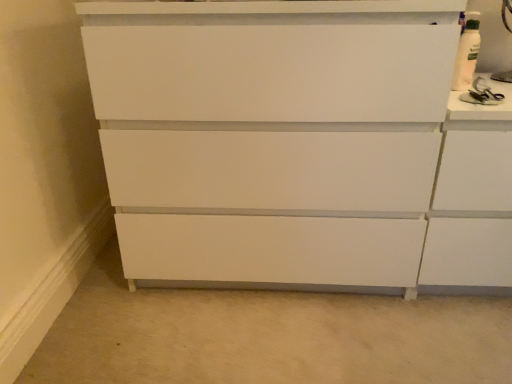
Question: Should I look upward or downward to see white matte chest of drawers at center?

Choices:
 (A) up
 (B) down

Answer: (A)

Question: Is white matte chest of drawers at center positioned with its back to white textured cabinet at upper right?

Choices:
 (A) yes
 (B) no

Answer: (B)

Question: From a real-world perspective, is white matte chest of drawers at center beneath white textured cabinet at upper right?

Choices:
 (A) yes
 (B) no

Answer: (B)

Question: Can you confirm if white matte chest of drawers at center is wider than white textured cabinet at upper right?

Choices:
 (A) yes
 (B) no

Answer: (A)

Question: Considering the relative sizes of white matte chest of drawers at center and white textured cabinet at upper right in the image provided, is white matte chest of drawers at center bigger than white textured cabinet at upper right?

Choices:
 (A) yes
 (B) no

Answer: (A)

Question: Would you say white textured cabinet at upper right is part of white matte chest of drawers at center's contents?

Choices:
 (A) no
 (B) yes

Answer: (A)

Question: Is white matte chest of drawers at center taller than white textured cabinet at upper right?

Choices:
 (A) no
 (B) yes

Answer: (B)

Question: Does white textured cabinet at upper right have a lesser height compared to white matte chest of drawers at center?

Choices:
 (A) no
 (B) yes

Answer: (B)

Question: Is white textured cabinet at upper right to the left of white matte chest of drawers at center from the viewer's perspective?

Choices:
 (A) no
 (B) yes

Answer: (A)

Question: Would you say white textured cabinet at upper right contains white matte chest of drawers at center?

Choices:
 (A) yes
 (B) no

Answer: (B)

Question: Does white textured cabinet at upper right appear on the right side of white matte chest of drawers at center?

Choices:
 (A) no
 (B) yes

Answer: (B)

Question: From the image's perspective, is white textured cabinet at upper right on white matte chest of drawers at center?

Choices:
 (A) no
 (B) yes

Answer: (A)

Question: Are white textured cabinet at upper right and white matte chest of drawers at center far apart?

Choices:
 (A) no
 (B) yes

Answer: (A)

Question: Considering the relative positions of white textured cabinet at upper right and white matte chest of drawers at center in the image provided, is white textured cabinet at upper right to the left or to the right of white matte chest of drawers at center?

Choices:
 (A) left
 (B) right

Answer: (B)